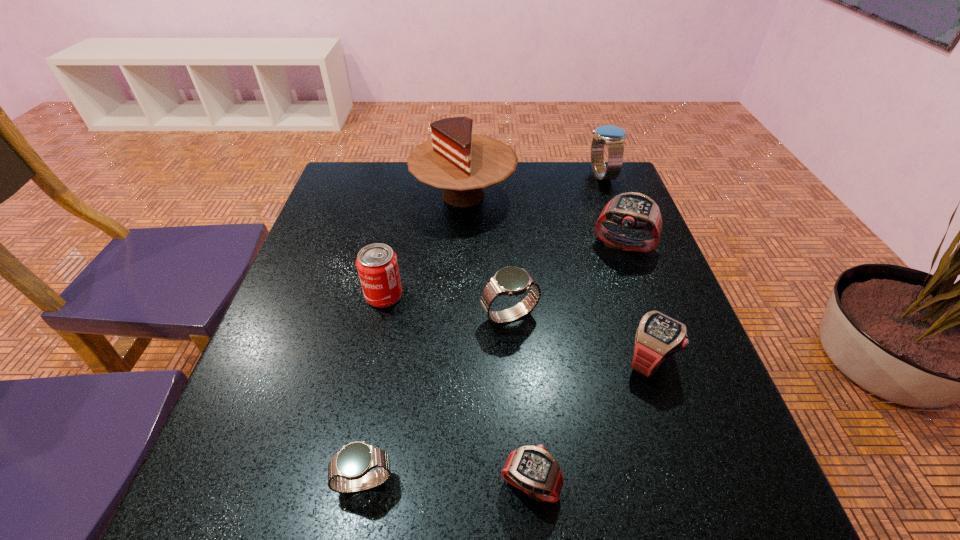
I want to click on free region located on the back of the second smallest red watch, so pyautogui.click(x=614, y=255).

You are a GUI agent. You are given a task and a screenshot of the screen. Output one action in this format:
    pyautogui.click(x=<x>, y=<y>)
    Task: Click on the free space located 0.230m on the back of the smallest blue watch
    
    Given the screenshot: What is the action you would take?
    click(389, 348)

Where is `vacant space located 0.150m on the left of the nearest red watch`? vacant space located 0.150m on the left of the nearest red watch is located at coordinates (404, 485).

Image resolution: width=960 pixels, height=540 pixels. Identify the location of cake that is at the far edge. (463, 164).

In order to click on watch situated at the far edge in this screenshot , I will do `click(613, 137)`.

At what (x,y) coordinates should I click in order to perform the action: click on object at the far right corner. Please return your answer as a coordinate pair (x, y). Image resolution: width=960 pixels, height=540 pixels. Looking at the image, I should click on (613, 137).

Locate an element on the screen. free space at the far edge of the desktop is located at coordinates (509, 202).

At what (x,y) coordinates should I click in order to perform the action: click on vacant space at the near edge of the desktop. Please return your answer as a coordinate pair (x, y). This screenshot has width=960, height=540. Looking at the image, I should click on (562, 520).

Where is `vacant point at the left edge`? Image resolution: width=960 pixels, height=540 pixels. vacant point at the left edge is located at coordinates (339, 226).

In the image, there is a desktop. Identify the location of free region at the right edge. (633, 285).